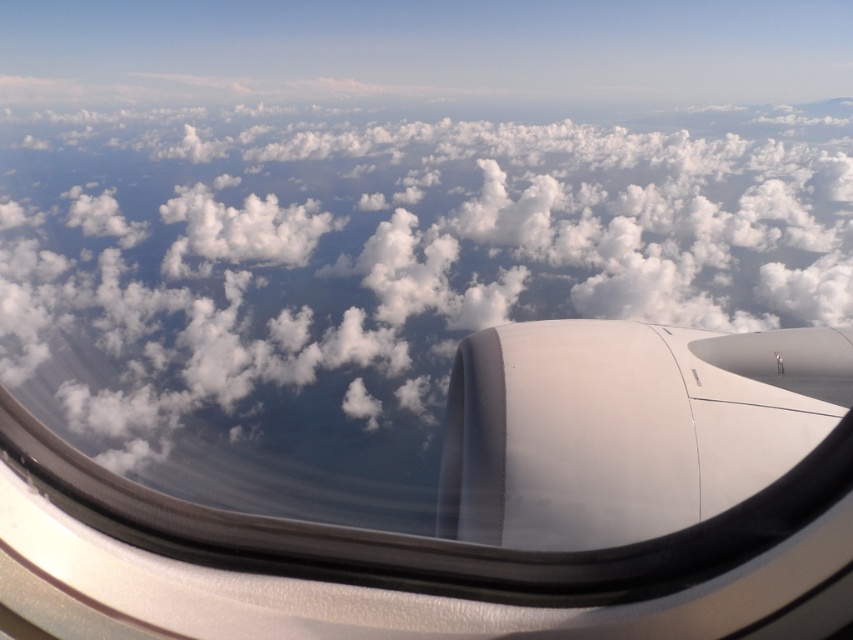
Can you confirm if white fluffy cloud at center is positioned to the left of white matte engine at lower right?

Incorrect, white fluffy cloud at center is not on the left side of white matte engine at lower right.

Between white fluffy cloud at center and white matte engine at lower right, which one has more height?

With more height is white fluffy cloud at center.

The height and width of the screenshot is (640, 853). What do you see at coordinates (379, 268) in the screenshot?
I see `white fluffy cloud at center` at bounding box center [379, 268].

Identify the location of white fluffy cloud at center. Image resolution: width=853 pixels, height=640 pixels. (379, 268).